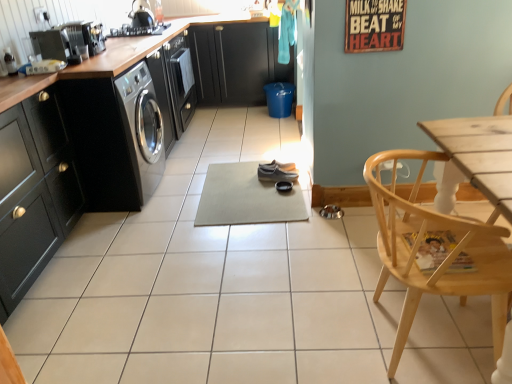
Image resolution: width=512 pixels, height=384 pixels. In order to click on vacant area to the left of light wood chair at lower right in this screenshot , I will do `click(288, 324)`.